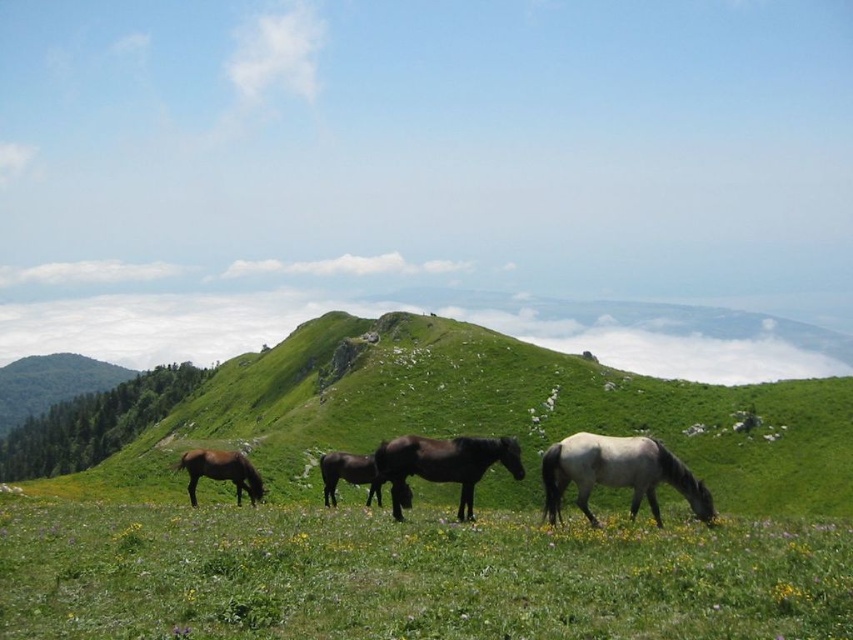
Question: Does green grassy field at lower center have a lesser width compared to gray matte horse at right?

Choices:
 (A) yes
 (B) no

Answer: (B)

Question: Can you confirm if green grassy hillside at center is bigger than dark brown glossy horse at center?

Choices:
 (A) yes
 (B) no

Answer: (A)

Question: Does shiny dark brown horse at center appear on the right side of brown glossy horse at lower left?

Choices:
 (A) yes
 (B) no

Answer: (A)

Question: Which point appears farthest from the camera in this image?

Choices:
 (A) (241, 484)
 (B) (374, 467)
 (C) (575, 355)

Answer: (C)

Question: Among these points, which one is farthest from the camera?

Choices:
 (A) (300, 595)
 (B) (339, 456)
 (C) (204, 452)

Answer: (B)

Question: Estimate the real-world distances between objects in this image. Which object is closer to the green grassy field at lower center?

Choices:
 (A) brown glossy horse at lower left
 (B) dark brown glossy horse at center
 (C) green grassy hillside at center

Answer: (B)